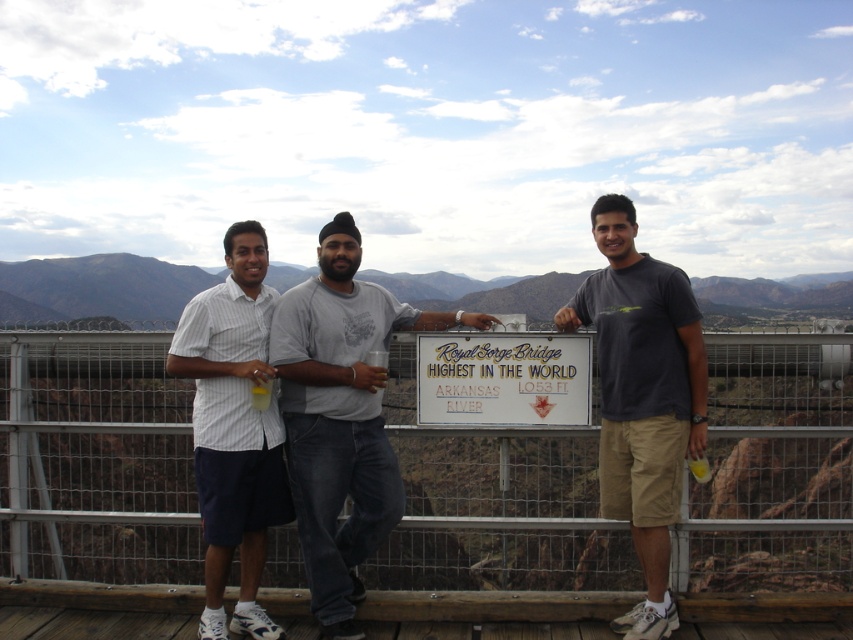
Question: Can you confirm if brown rocky mountain at center is thinner than gold metallic sign at center?

Choices:
 (A) no
 (B) yes

Answer: (A)

Question: Is metal fence at center below gray cotton t-shirt at center?

Choices:
 (A) yes
 (B) no

Answer: (A)

Question: Which object appears closest to the camera in this image?

Choices:
 (A) gray cotton t-shirt at center
 (B) dark gray t-shirt at center
 (C) white striped shirt at left
 (D) brown rocky mountain at center

Answer: (B)

Question: Which object is the farthest from the gray cotton t-shirt at center?

Choices:
 (A) white striped shirt at left
 (B) gold metallic sign at center
 (C) dark gray t-shirt at center

Answer: (C)

Question: Observing the image, what is the correct spatial positioning of metal fence at center in reference to gray cotton t-shirt at center?

Choices:
 (A) left
 (B) right

Answer: (B)

Question: Which of the following is the closest to the observer?

Choices:
 (A) (730, 310)
 (B) (180, 412)

Answer: (B)